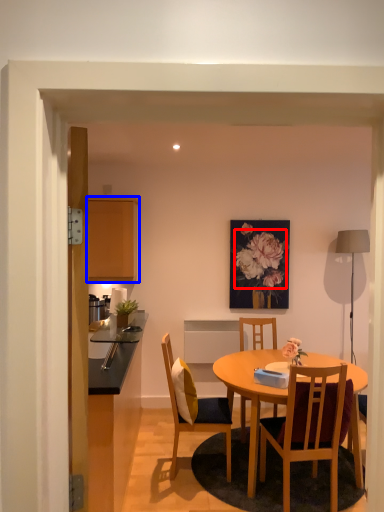
Question: Which object appears farthest to the camera in this image, flower (highlighted by a red box) or cabinetry (highlighted by a blue box)?

Choices:
 (A) flower
 (B) cabinetry

Answer: (A)